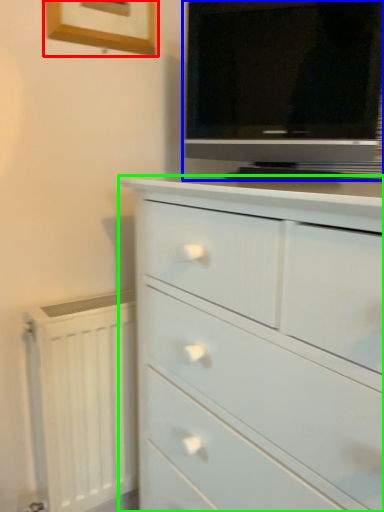
Question: Which object is the closest to the picture frame (highlighted by a red box)? Choose among these: television (highlighted by a blue box) or chest of drawers (highlighted by a green box).

Choices:
 (A) television
 (B) chest of drawers

Answer: (A)